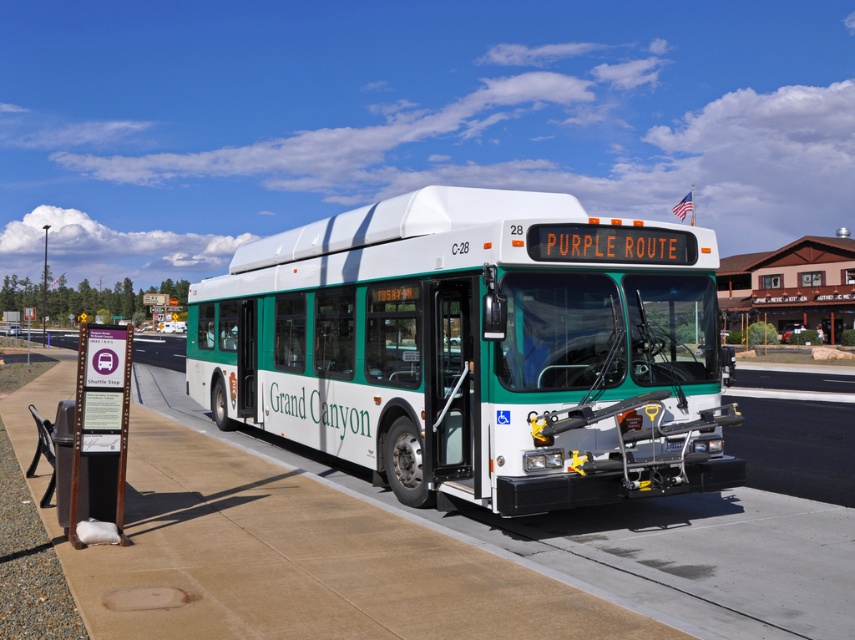
Question: From the image, what is the correct spatial relationship of green matte bus at center in relation to brown concrete pavement at center?

Choices:
 (A) left
 (B) right

Answer: (B)

Question: Which of these objects is positioned closest to the brown concrete pavement at center?

Choices:
 (A) green matte bus at center
 (B) white plastic bus stop at center

Answer: (A)

Question: Does green matte bus at center have a lesser width compared to white plastic bus stop at center?

Choices:
 (A) no
 (B) yes

Answer: (B)

Question: Does green matte bus at center have a greater width compared to brown concrete pavement at center?

Choices:
 (A) no
 (B) yes

Answer: (A)

Question: Among these points, which one is nearest to the camera?

Choices:
 (A) (499, 420)
 (B) (789, 243)
 (C) (262, 486)

Answer: (A)

Question: Which point is farther to the camera?

Choices:
 (A) white plastic bus stop at center
 (B) green matte bus at center

Answer: (A)